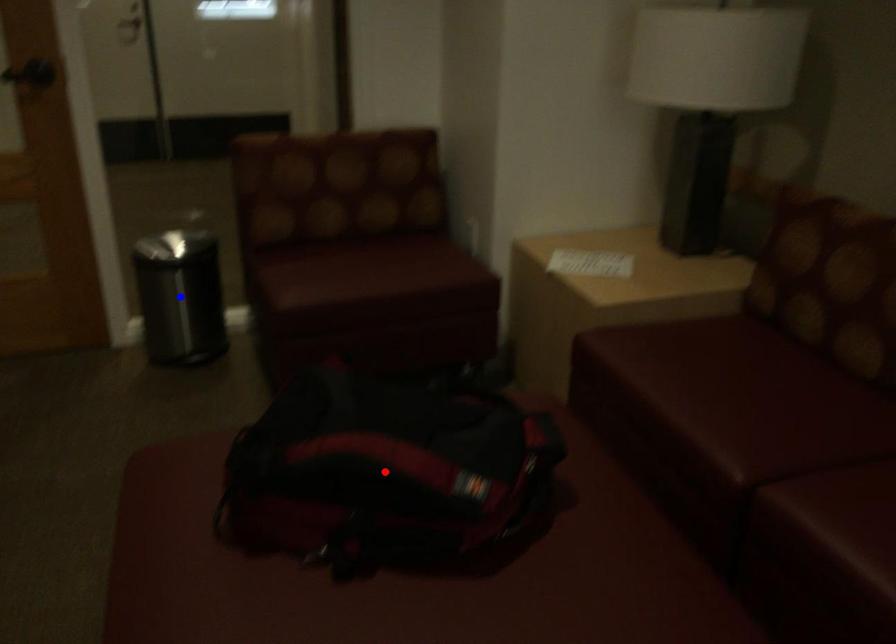
Question: Which of the two points in the image is closer to the camera?

Choices:
 (A) Blue point is closer.
 (B) Red point is closer.

Answer: (B)